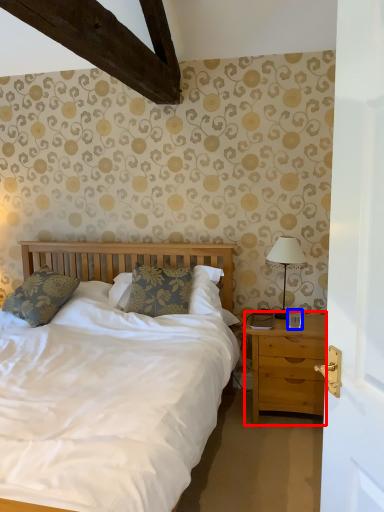
Question: Which point is further to the camera, nightstand (highlighted by a red box) or coffee cup (highlighted by a blue box)?

Choices:
 (A) nightstand
 (B) coffee cup

Answer: (B)